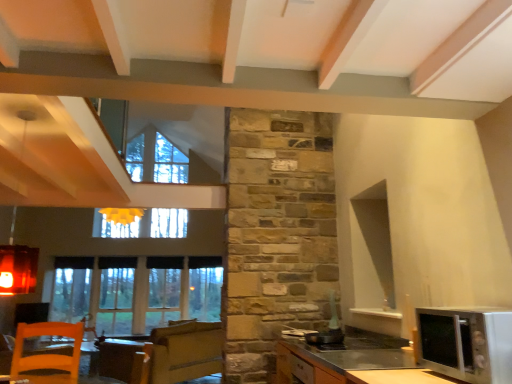
Question: Is clear glass window at lower left wider or thinner than silver metallic microwave at lower right?

Choices:
 (A) wide
 (B) thin

Answer: (B)

Question: Is clear glass window at lower left taller or shorter than silver metallic microwave at lower right?

Choices:
 (A) tall
 (B) short

Answer: (A)

Question: Considering the real-world distances, which object is farthest from the orange wooden chair at lower left?

Choices:
 (A) satin silver microwave at lower right
 (B) clear glass window at lower left
 (C) silver metallic microwave at lower right

Answer: (C)

Question: Estimate the real-world distances between objects in this image. Which object is farther from the satin silver microwave at lower right?

Choices:
 (A) clear glass window at lower left
 (B) silver metallic microwave at lower right
 (C) orange wooden chair at lower left

Answer: (C)